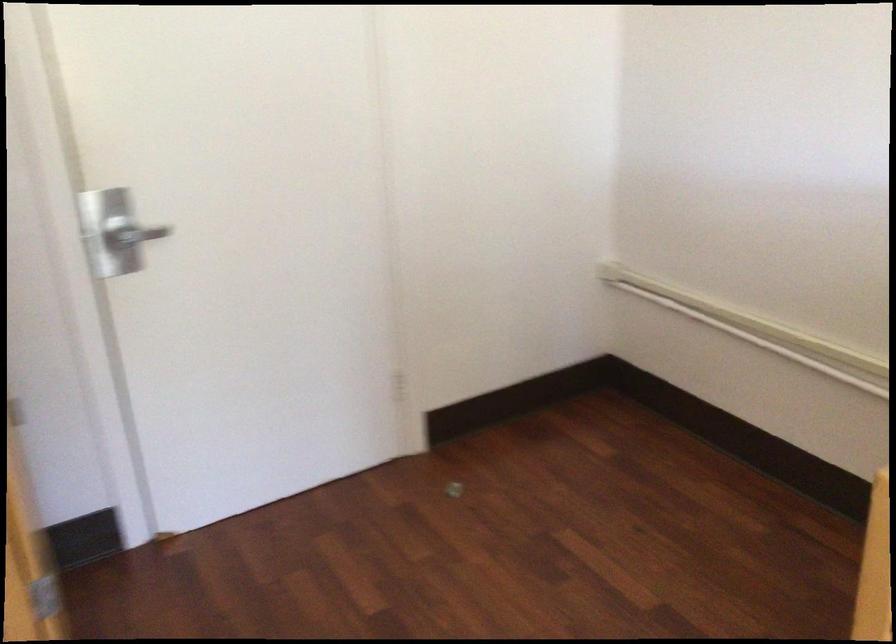
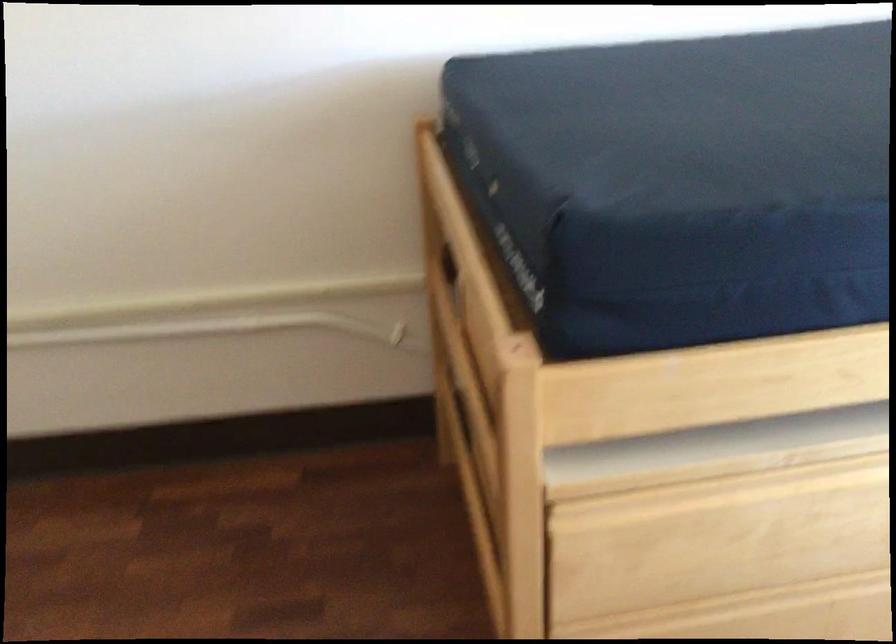
From the picture: The images are taken continuously from a first-person perspective. In which direction is your viewpoint rotating?

The rotation direction of the camera is right-down.